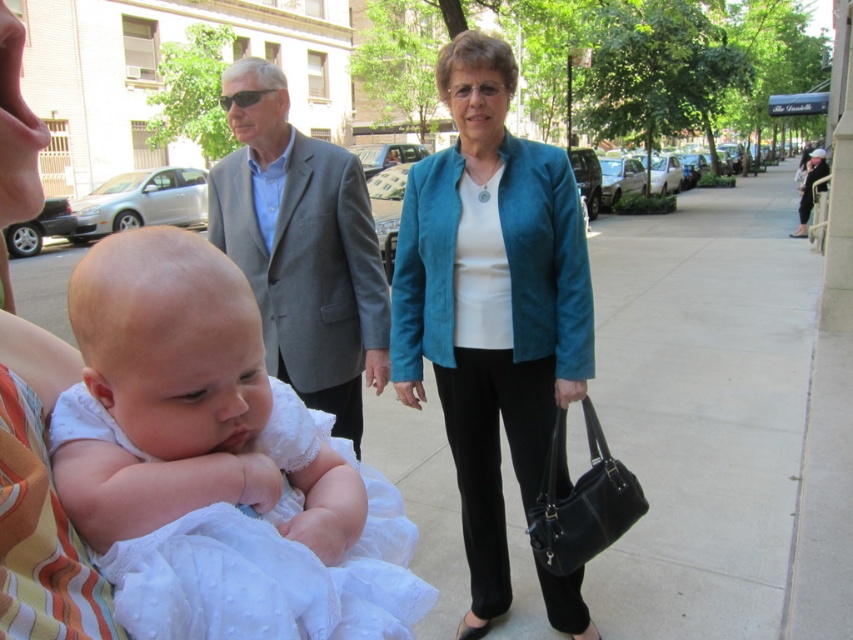
You are a delivery person trying to place a package on the ground. The package is the size of the gray fabric suit at center. Can you fit it on the smooth concrete sidewalk at center without it overlapping the edge?

The smooth concrete sidewalk at center has a larger size compared to gray fabric suit at center, so yes, the package can be placed on the smooth concrete sidewalk at center without overlapping the edge.

You are a delivery person who needs to place a package between the gray fabric suit at center and the teal leather jacket at center. The package requires a minimum of 2 meters of space. Can you fit it between them?

The gray fabric suit at center and teal leather jacket at center are 1.97 meters apart from each other, which is less than the required 2 meters. Therefore, the package cannot be placed between them.